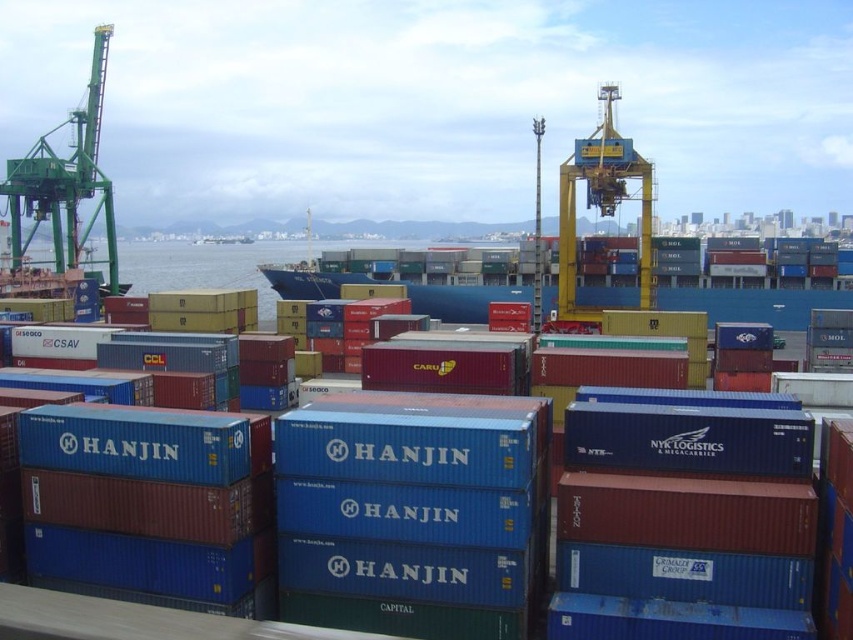
Can you confirm if blue matte container at center is taller than green painted metal crane at left?

No.

Can you confirm if blue matte container at center is positioned above green painted metal crane at left?

No, blue matte container at center is not above green painted metal crane at left.

Is point (834, 445) farther from viewer compared to point (38, 189)?

No, (834, 445) is closer to viewer.

Where is `blue matte container at center`? blue matte container at center is located at coordinates (686, 486).